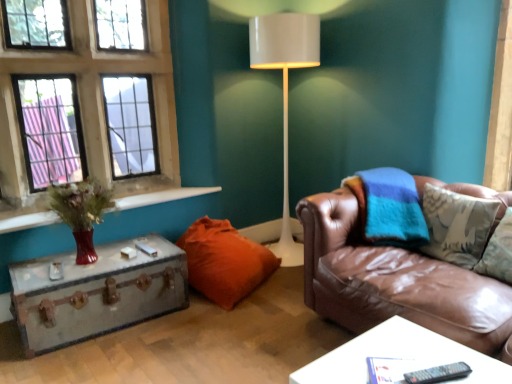
Question: Based on their sizes in the image, would you say orange fabric pillow at lower center is bigger or smaller than white glossy floor lamp at center?

Choices:
 (A) big
 (B) small

Answer: (B)

Question: Is orange fabric pillow at lower center taller or shorter than white glossy floor lamp at center?

Choices:
 (A) short
 (B) tall

Answer: (A)

Question: Estimate the real-world distances between objects in this image. Which object is closer to the glass paneled window at upper left?

Choices:
 (A) orange fabric pillow at lower center
 (B) black plastic remote at lower right
 (C) metallic suitcase at left, which ranks as the second table in front-to-back order
 (D) matte glass vase at left
 (E) white glossy floor lamp at center

Answer: (D)

Question: Which object is the closest to the orange fabric pillow at lower center?

Choices:
 (A) white glossy floor lamp at center
 (B) metallic suitcase at left, which ranks as the second table in front-to-back order
 (C) matte glass vase at left
 (D) black plastic remote at lower right
 (E) brown leather couch at right

Answer: (B)